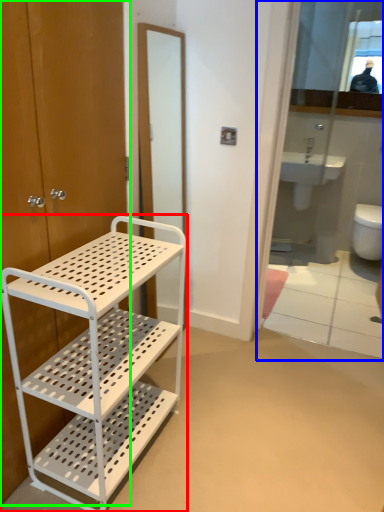
Question: Estimate the real-world distances between objects in this image. Which object is closer to bathroom cabinet (highlighted by a red box), mirror (highlighted by a blue box) or door (highlighted by a green box)?

Choices:
 (A) mirror
 (B) door

Answer: (B)